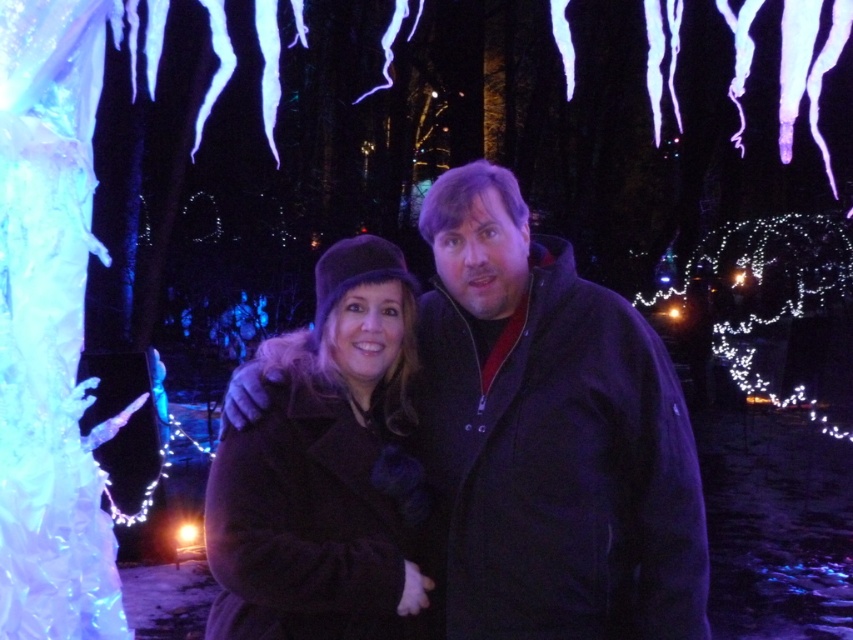
Question: Can you confirm if dark brown coat at center is positioned to the left of velvet black coat at center?

Choices:
 (A) no
 (B) yes

Answer: (A)

Question: Does dark brown coat at center have a lesser width compared to velvet black coat at center?

Choices:
 (A) no
 (B) yes

Answer: (A)

Question: Which of the following is the farthest from the observer?

Choices:
 (A) (674, 536)
 (B) (265, 596)

Answer: (A)

Question: Which of the following is the closest to the observer?

Choices:
 (A) (512, 372)
 (B) (218, 561)

Answer: (B)

Question: Can you confirm if dark brown coat at center is wider than velvet black coat at center?

Choices:
 (A) no
 (B) yes

Answer: (B)